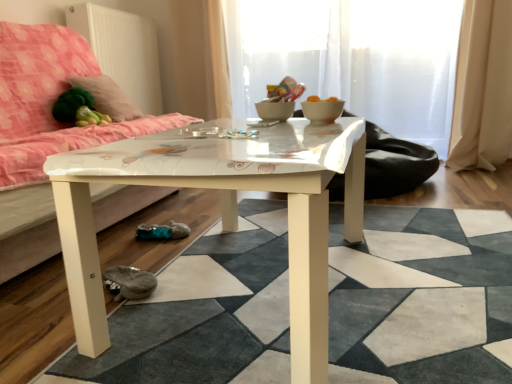
Where is `vacant space that is to the left of gray suede shoe at lower left`? This screenshot has height=384, width=512. vacant space that is to the left of gray suede shoe at lower left is located at coordinates (46, 299).